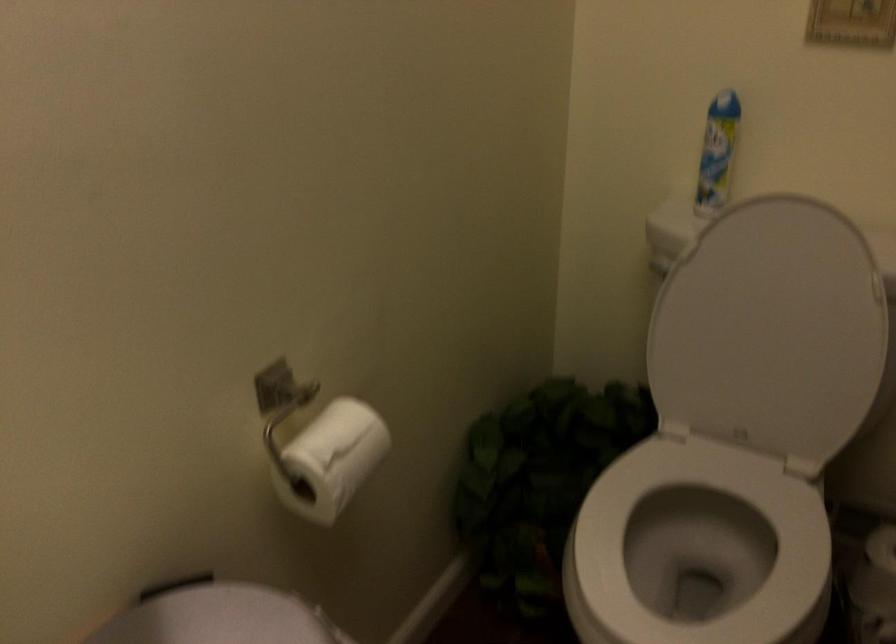
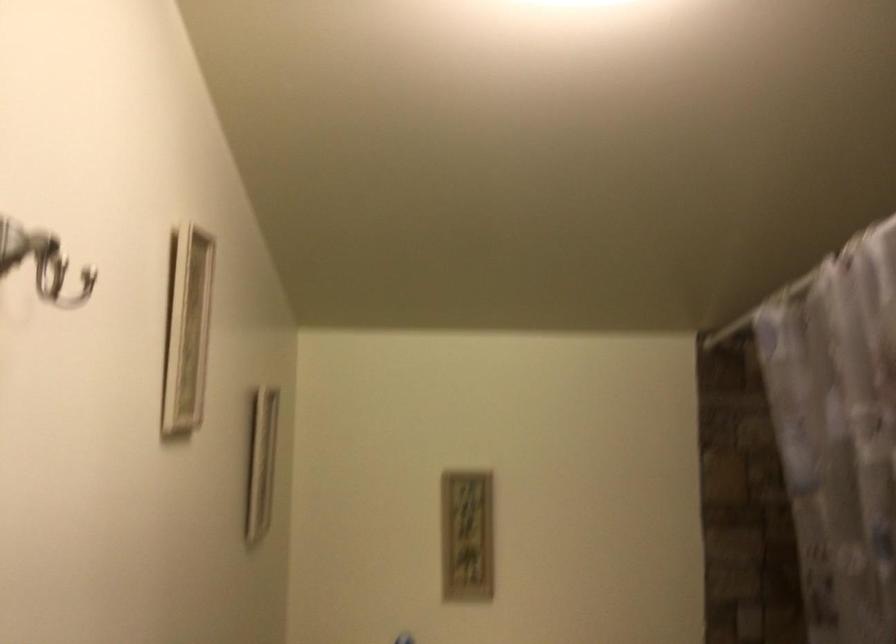
The first image is from the beginning of the video and the second image is from the end. How did the camera likely rotate when shooting the video?

The camera rotated toward right-up.